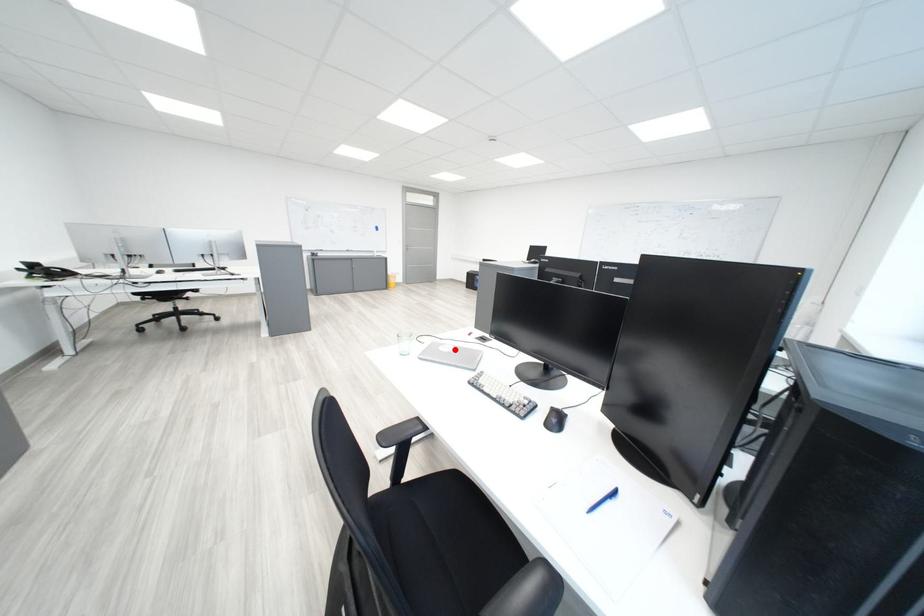
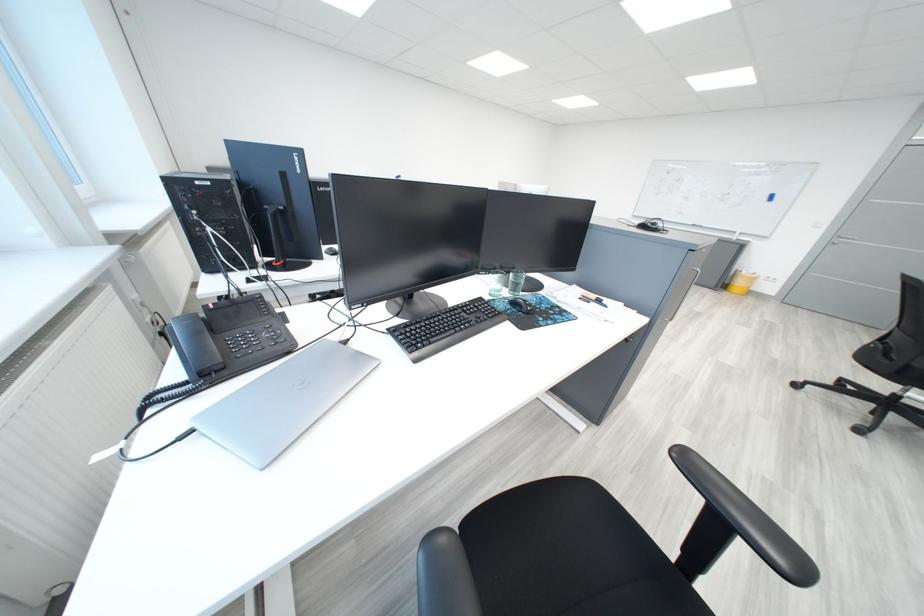
Question: I am providing you with two images of the same scene from different viewpoints. A red point is marked on the first image. Can you still see the location of the red point in image 2?

Choices:
 (A) Yes
 (B) No

Answer: (B)